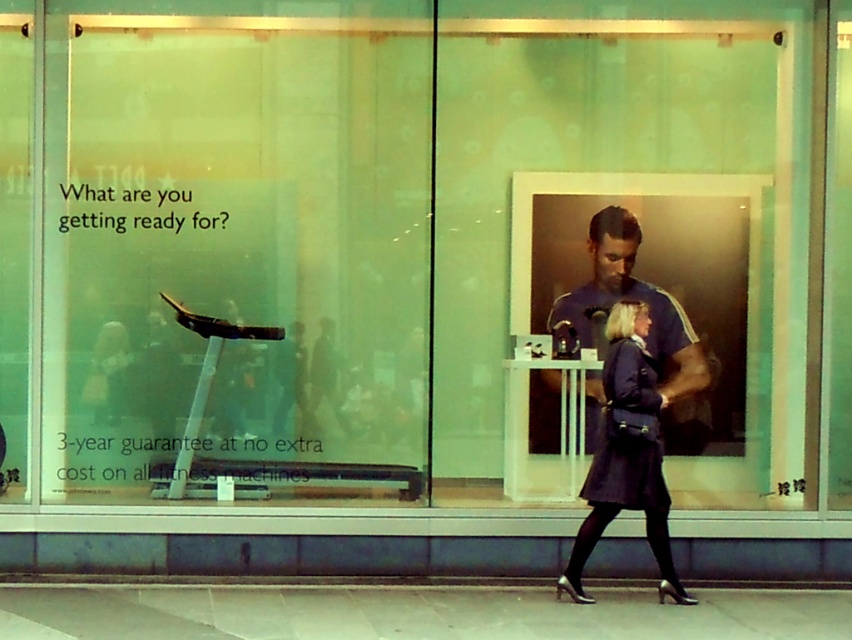
You are standing in front of the storefront window display. You notice two points marked in the image. The first point is at coordinate point (471,627) and the second point is at coordinate point (681,432). Which point is closer to you?

Point (471,627) is closer to the camera than point (681,432).

You are a delivery person who needs to place a dark blue fabric coat at lower center in the storefront window display. The store manager says the coat must be placed at point 0.708, 0.737. Where should you place it?

The dark blue fabric coat at lower center should be placed at point (626, 452) as specified by the store manager.